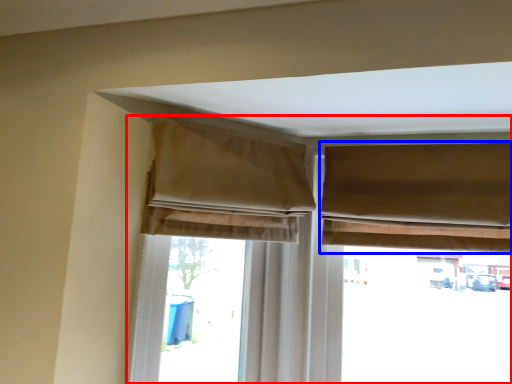
Question: Which of the following is the farthest to the observer, window (highlighted by a red box) or curtain (highlighted by a blue box)?

Choices:
 (A) window
 (B) curtain

Answer: (A)